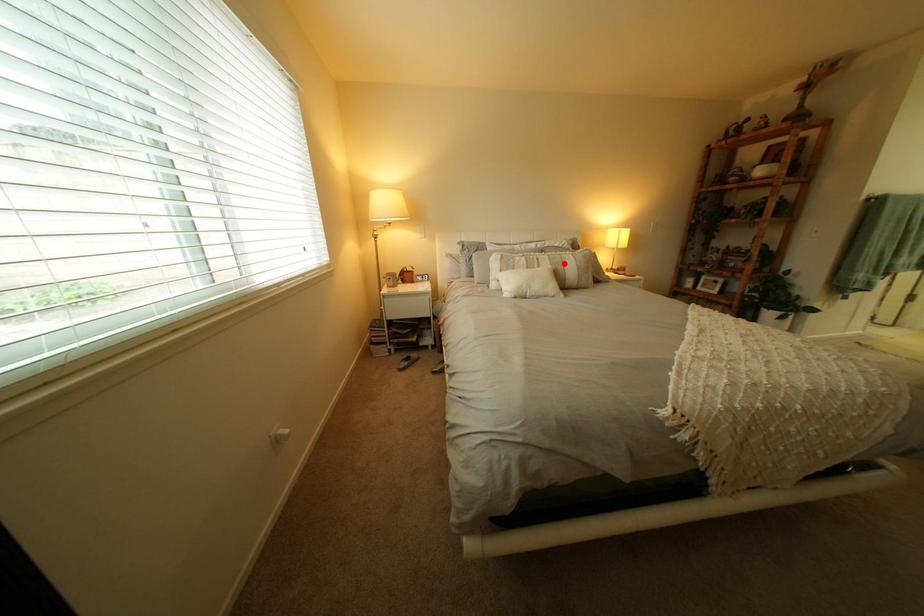
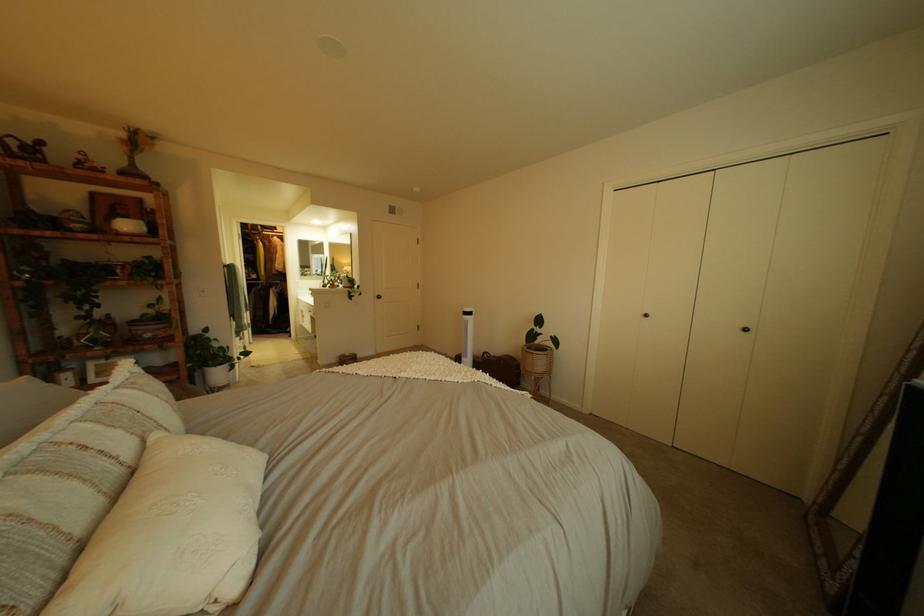
In the second image, find the point that corresponds to the highlighted location in the first image.

(134, 434)